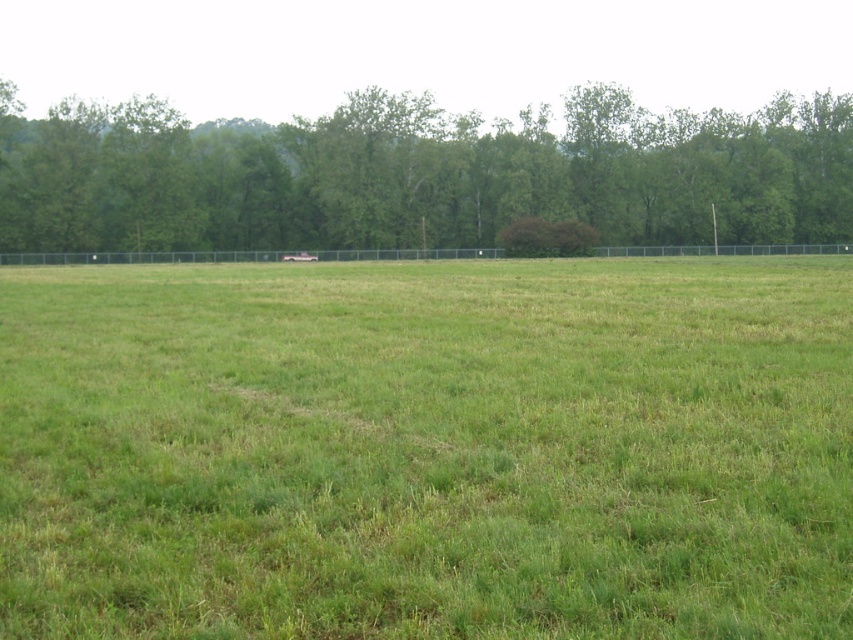
You are standing on the green grassy field at center and want to walk towards the green leafy tree at upper center. Which direction should you head?

You should head upwards since the green grassy field at center is located below the green leafy tree at upper center.

You are standing in the middle of the green grassy field at center and want to walk towards the green leafy tree at upper center. Which direction should you walk to reach it?

You should walk towards the upper center direction to reach the green leafy tree at upper center since it is located above the green grassy field at center.

You are standing at the point marked by the coordinates point (427,449) in the image. Looking around, you see the green grassy field at center. Which direction should you walk to reach the dense line of trees in the background?

Since the point (427,449) marks the green grassy field at center, and the dense line of trees is in the background, you should walk forward towards the direction where the trees are located, which is behind the field beyond the metal fence.